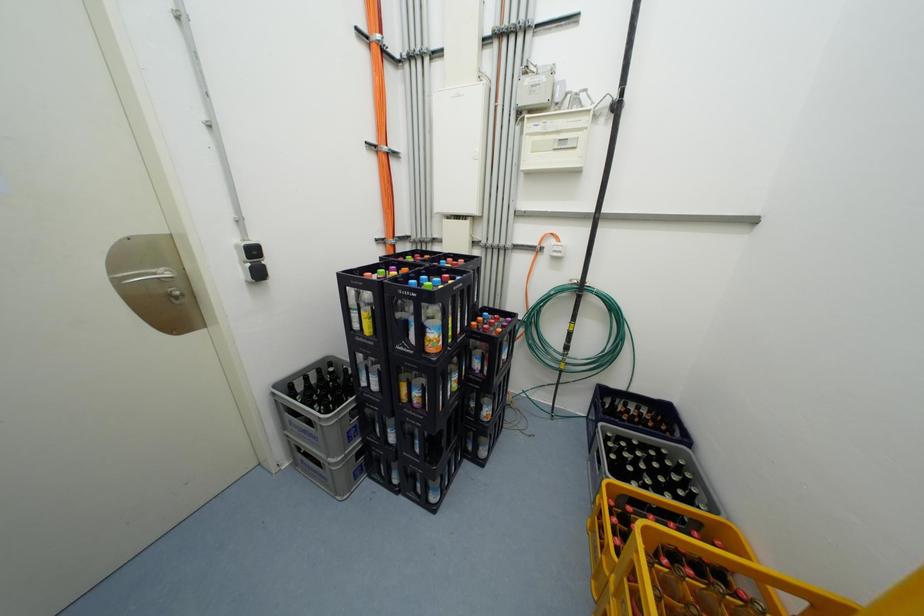
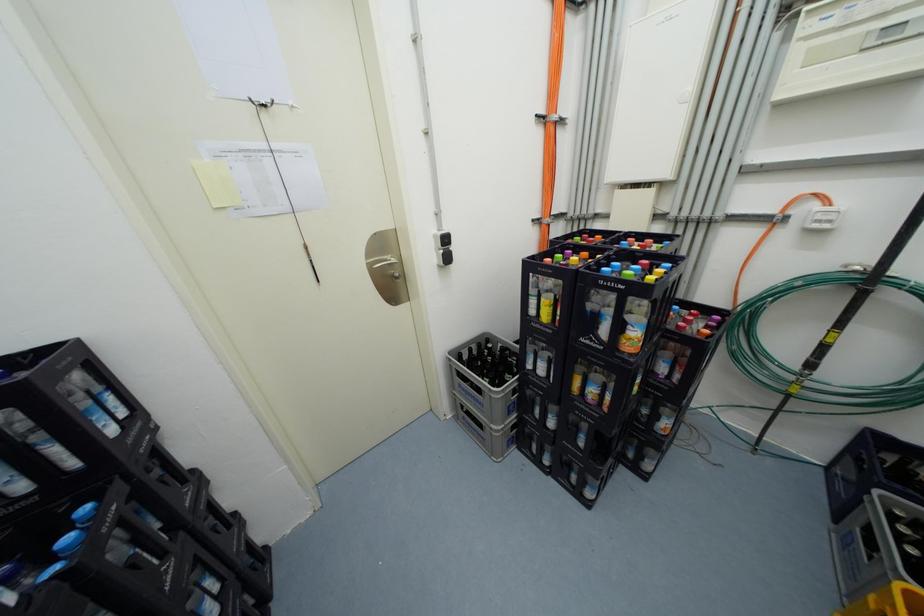
Question: The camera is either moving clockwise (left) or counter-clockwise (right) around the object. The first image is from the beginning of the video and the second image is from the end. Is the camera moving left or right when shooting the video?

Choices:
 (A) Left
 (B) Right

Answer: (B)